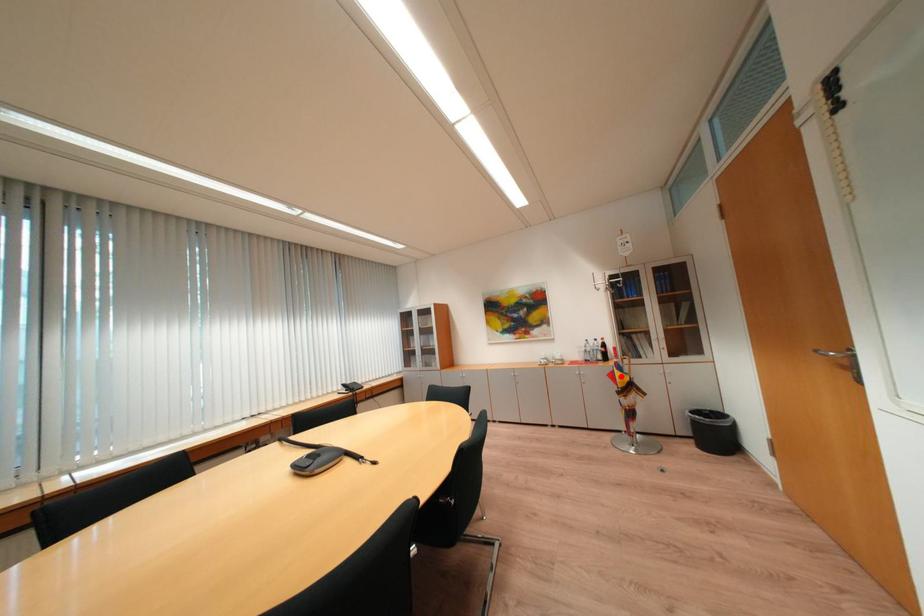
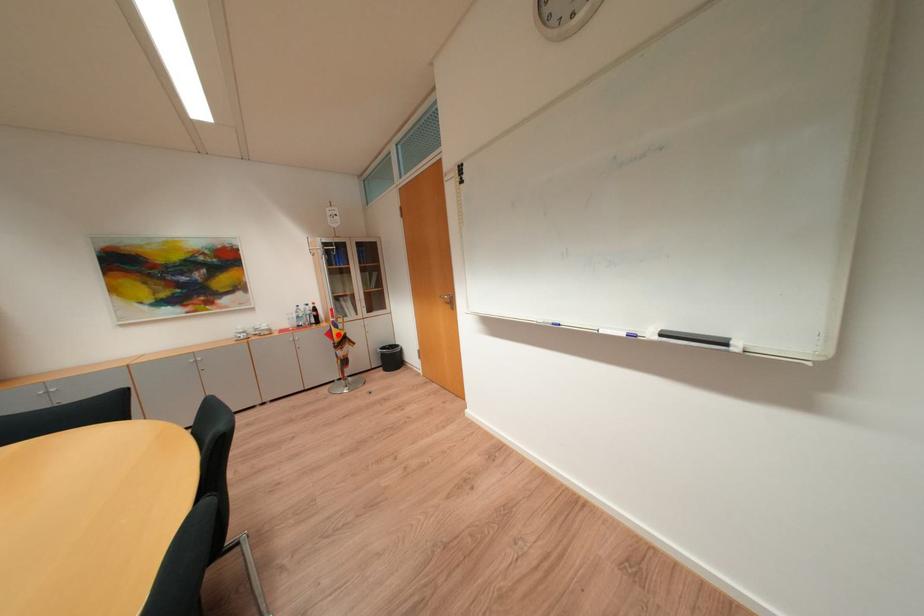
I am providing you with two images of the same scene from different viewpoints. A red point is marked on the first image and another point is marked on the second image. Is the marked point in image1 the same physical position as the marked point in image2?

Yes